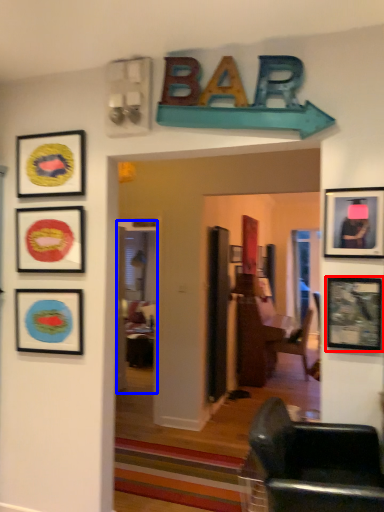
Question: Which point is closer to the camera, picture frame (highlighted by a red box) or glass door (highlighted by a blue box)?

Choices:
 (A) picture frame
 (B) glass door

Answer: (A)